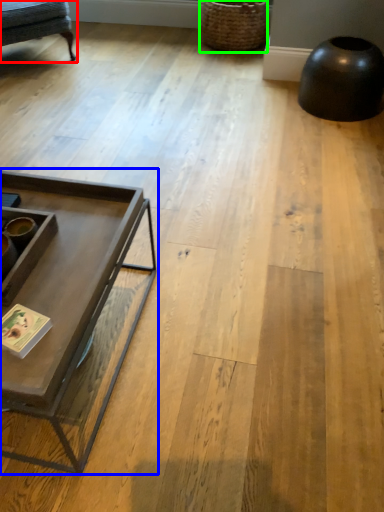
Question: Based on their relative distances, which object is farther from swivel chair (highlighted by a red box)? Choose from coffee table (highlighted by a blue box) and basket (highlighted by a green box).

Choices:
 (A) coffee table
 (B) basket

Answer: (A)